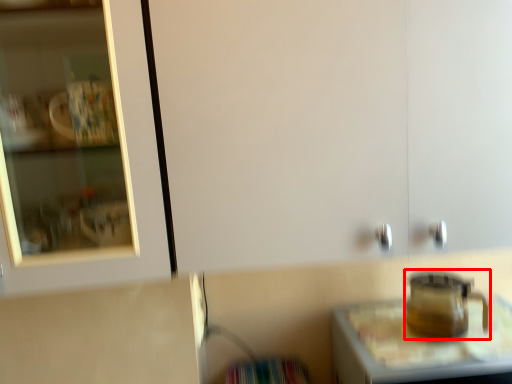
Question: Where is appliance (annotated by the red box) located in relation to table in the image?

Choices:
 (A) left
 (B) right

Answer: (A)